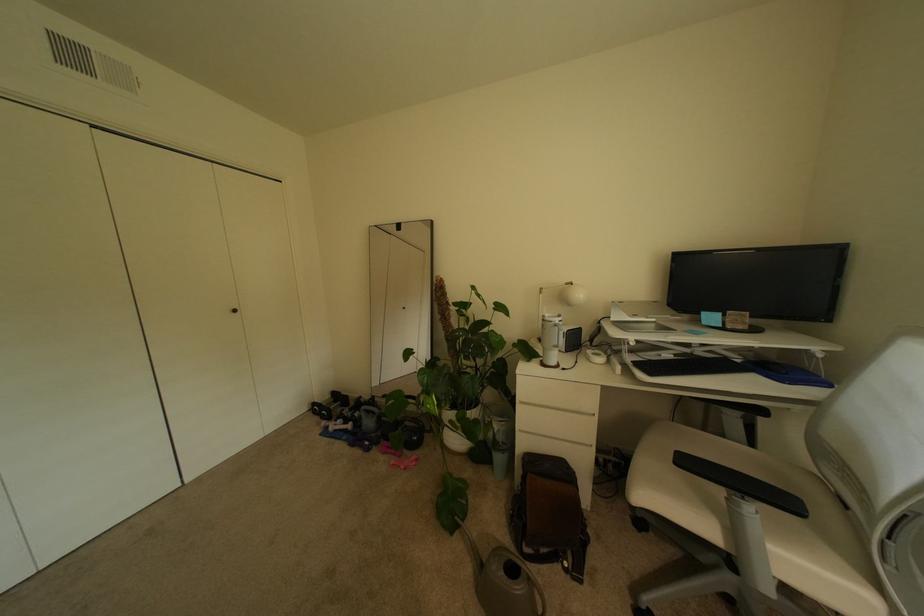
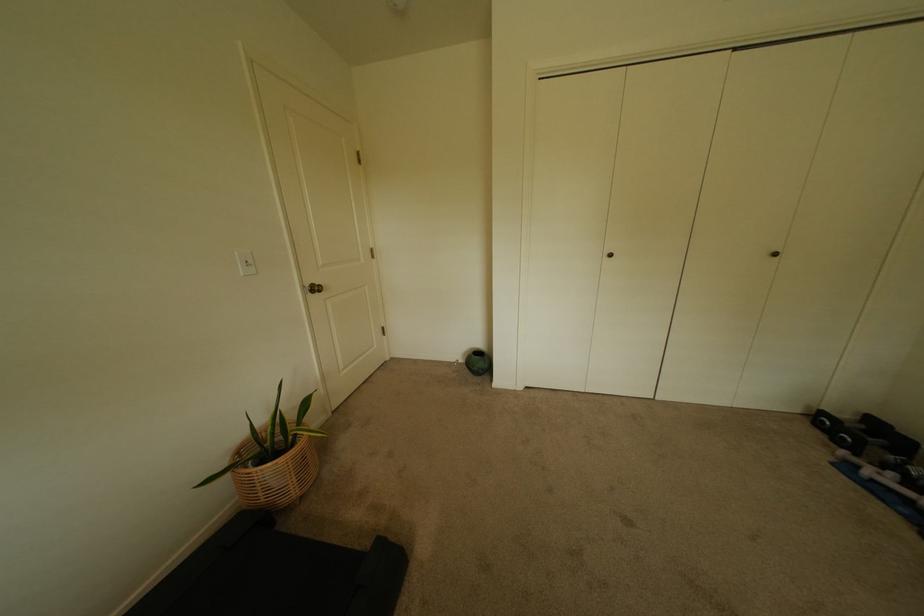
Locate, in the second image, the point that corresponds to point (244, 312) in the first image.

(784, 256)